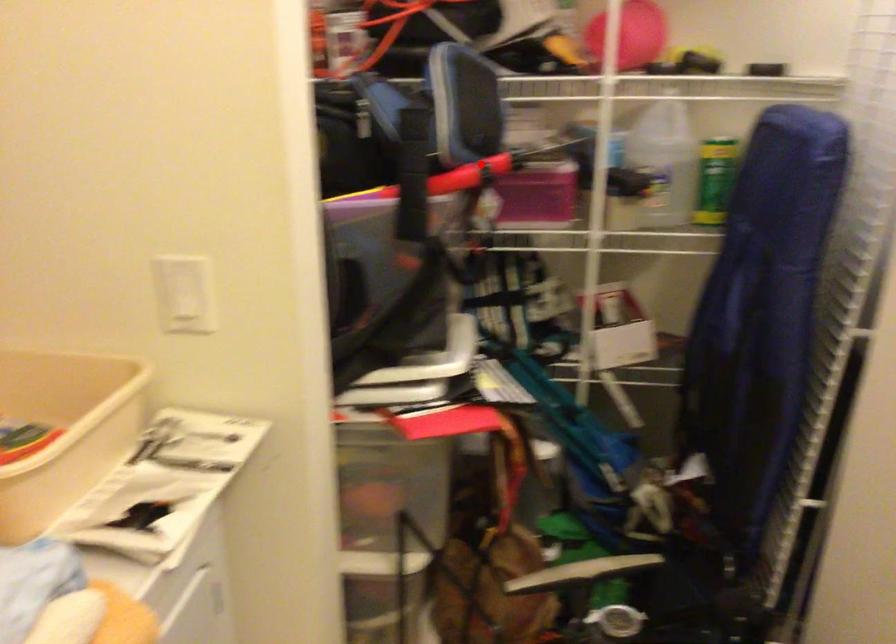
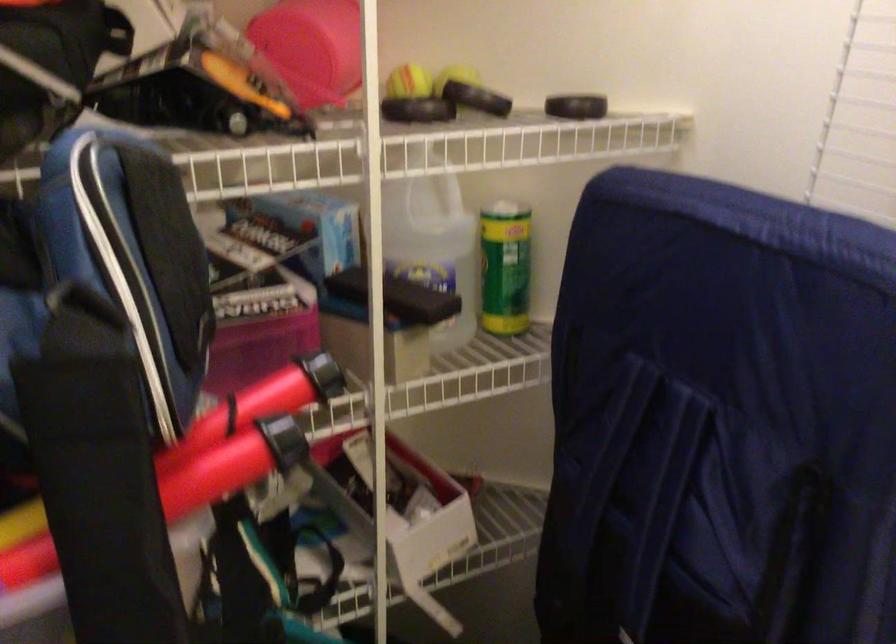
Find the pixel in the second image that matches the highlighted location in the first image.

(282, 440)